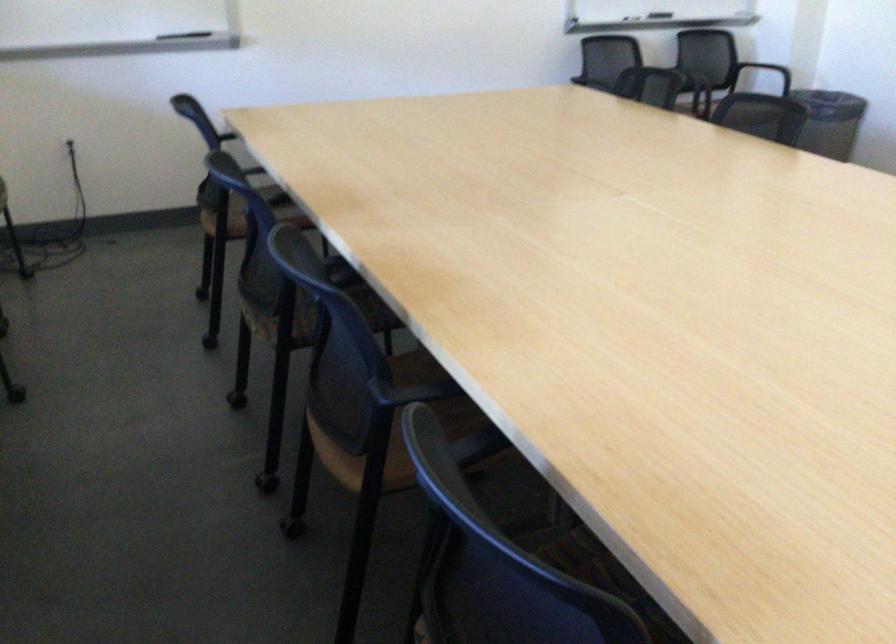
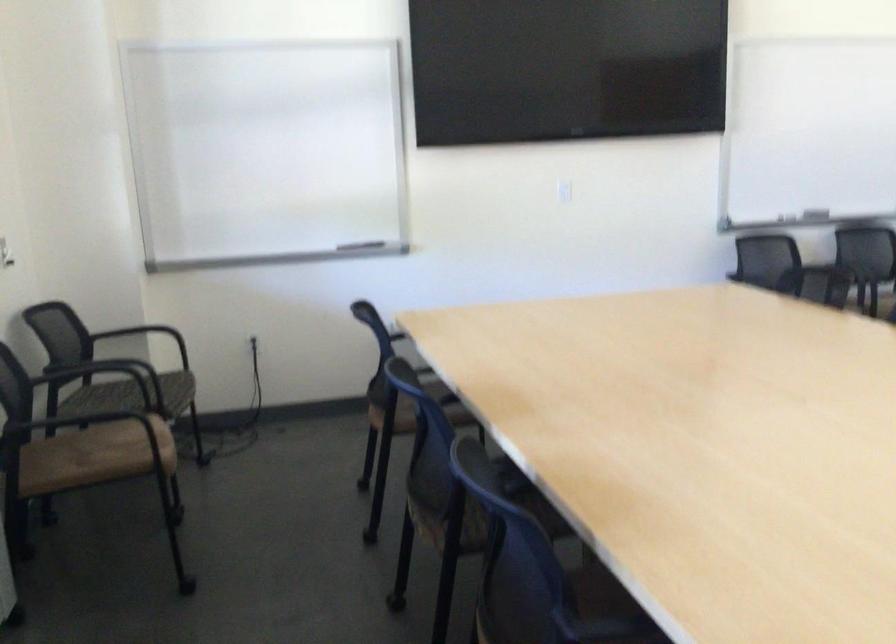
Question: The images are taken continuously from a first-person perspective. In which direction is your viewpoint rotating?

Choices:
 (A) Left
 (B) Right
 (C) Up
 (D) Down

Answer: (C)